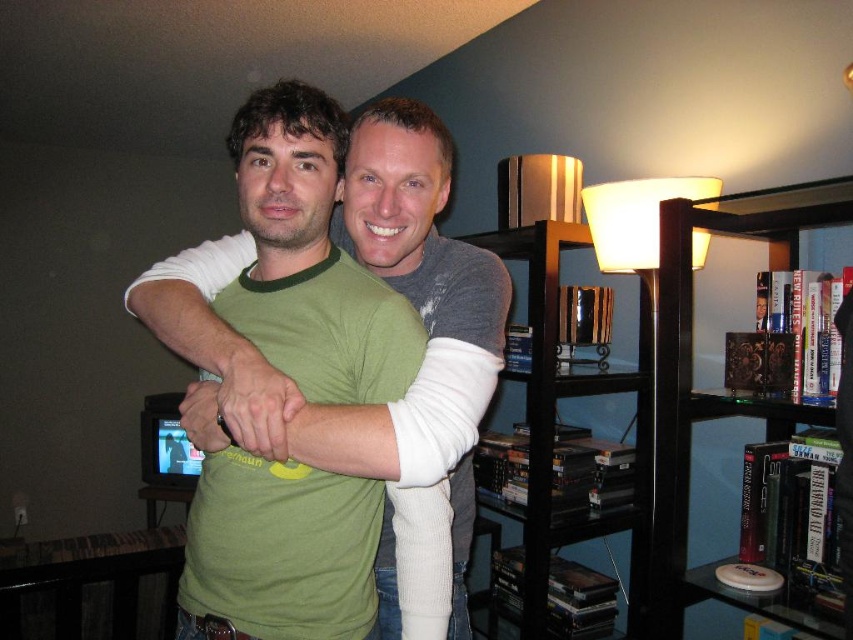
Does green cotton t-shirt at center appear under black glossy bookshelf at right?

Actually, green cotton t-shirt at center is above black glossy bookshelf at right.

The width and height of the screenshot is (853, 640). What do you see at coordinates (422, 321) in the screenshot?
I see `green cotton t-shirt at center` at bounding box center [422, 321].

What do you see at coordinates (422, 321) in the screenshot? I see `green cotton t-shirt at center` at bounding box center [422, 321].

Where is `green cotton t-shirt at center`? The height and width of the screenshot is (640, 853). green cotton t-shirt at center is located at coordinates (422, 321).

Does green cotton t-shirt at center have a greater width compared to transparent glass bookcase at right?

Indeed, green cotton t-shirt at center has a greater width compared to transparent glass bookcase at right.

Is green cotton t-shirt at center to the right of transparent glass bookcase at right from the viewer's perspective?

Incorrect, green cotton t-shirt at center is not on the right side of transparent glass bookcase at right.

Measure the distance between point (494, 307) and camera.

Point (494, 307) is 3.57 feet from camera.

Find the location of a particular element. Image resolution: width=853 pixels, height=640 pixels. green cotton t-shirt at center is located at coordinates (422, 321).

What do you see at coordinates (691, 365) in the screenshot? I see `transparent glass bookcase at right` at bounding box center [691, 365].

Can you confirm if transparent glass bookcase at right is taller than green matte shirt at center?

Indeed, transparent glass bookcase at right has a greater height compared to green matte shirt at center.

I want to click on transparent glass bookcase at right, so click(691, 365).